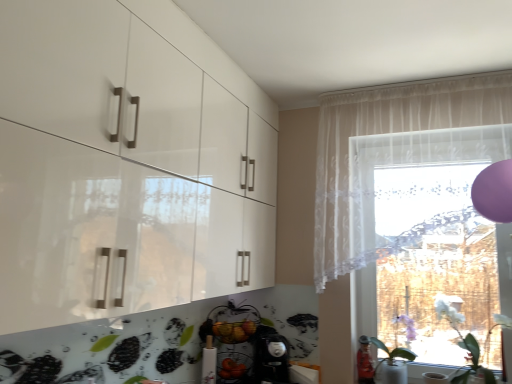
Measure the distance between transparent lace curtain at right and camera.

transparent lace curtain at right is 2.14 meters from camera.

What is the approximate height of white matte plant at lower right, which ranks as the 1th plant in right-to-left order?

19.20 inches.

This screenshot has width=512, height=384. I want to click on transparent lace curtain at right, so click(426, 231).

Does white glossy vase at lower right, which ranks as the 2th plant in right-to-left order, lie behind sheer white curtain at upper right?

Yes, it is.

Is white glossy vase at lower right, which ranks as the 2th plant in right-to-left order, positioned with its back to sheer white curtain at upper right?

white glossy vase at lower right, which ranks as the 2th plant in right-to-left order, is not turned away from sheer white curtain at upper right.

Does white glossy vase at lower right, which ranks as the 2th plant in right-to-left order, touch sheer white curtain at upper right?

No, white glossy vase at lower right, which ranks as the 2th plant in right-to-left order, is not beside sheer white curtain at upper right.

Do you think white glossy vase at lower right, arranged as the 1th plant when viewed from the left, is within sheer white curtain at upper right, or outside of it?

white glossy vase at lower right, arranged as the 1th plant when viewed from the left, exists outside the volume of sheer white curtain at upper right.

Which is nearer, (459,315) or (373,199)?

The point (459,315) is closer to the camera.

From the image's perspective, which one is positioned higher, white matte plant at lower right, which ranks as the 1th plant in right-to-left order, or transparent lace curtain at right?

transparent lace curtain at right.

How many degrees apart are the facing directions of white matte plant at lower right, which ranks as the 1th plant in right-to-left order, and transparent lace curtain at right?

There is a 0.000495-degree angle between the facing directions of white matte plant at lower right, which ranks as the 1th plant in right-to-left order, and transparent lace curtain at right.

Is white matte plant at lower right, which ranks as the second plant in left-to-right order, surrounding transparent lace curtain at right?

Actually, transparent lace curtain at right is outside white matte plant at lower right, which ranks as the second plant in left-to-right order.

From a real-world perspective, which is physically below, transparent lace curtain at right or white glossy vase at lower right, arranged as the 1th plant when viewed from the left?

white glossy vase at lower right, arranged as the 1th plant when viewed from the left, is physically lower.

Considering the positions of objects transparent lace curtain at right and white glossy vase at lower right, arranged as the 1th plant when viewed from the left, in the image provided, who is in front, transparent lace curtain at right or white glossy vase at lower right, arranged as the 1th plant when viewed from the left,?

Positioned in front is transparent lace curtain at right.

Looking at this image, which is more to the left, transparent lace curtain at right or white glossy vase at lower right, which ranks as the 2th plant in right-to-left order?

white glossy vase at lower right, which ranks as the 2th plant in right-to-left order, is more to the left.

Which is closer to the camera, (450,292) or (405,317)?

Point (450,292).

Consider the image. Is transparent lace curtain at right shorter than sheer white curtain at upper right?

In fact, transparent lace curtain at right may be taller than sheer white curtain at upper right.

Based on the photo, between transparent lace curtain at right and sheer white curtain at upper right, which one is positioned behind?

transparent lace curtain at right is more distant.

Is sheer white curtain at upper right surrounded by transparent lace curtain at right?

No, sheer white curtain at upper right is not a part of transparent lace curtain at right.

How different are the orientations of white glossy vase at lower right, arranged as the 1th plant when viewed from the left, and transparent lace curtain at right in degrees?

The angle between the facing direction of white glossy vase at lower right, arranged as the 1th plant when viewed from the left, and the facing direction of transparent lace curtain at right is 0.000183 degrees.

Is white glossy vase at lower right, which ranks as the 2th plant in right-to-left order, looking in the opposite direction of transparent lace curtain at right?

Yes, white glossy vase at lower right, which ranks as the 2th plant in right-to-left order, is facing away from transparent lace curtain at right.

In the scene shown: Which object is more forward, white glossy vase at lower right, arranged as the 1th plant when viewed from the left, or transparent lace curtain at right?

transparent lace curtain at right is closer to the camera.

Can you confirm if white glossy vase at lower right, arranged as the 1th plant when viewed from the left, is positioned to the left of transparent lace curtain at right?

Yes.

The height and width of the screenshot is (384, 512). Find the location of `plant in front of the transparent lace curtain at right`. plant in front of the transparent lace curtain at right is located at coordinates (464, 344).

Between transparent lace curtain at right and white matte plant at lower right, which ranks as the 1th plant in right-to-left order, which one appears on the left side from the viewer's perspective?

Positioned to the left is transparent lace curtain at right.

From a real-world perspective, is transparent lace curtain at right physically below white matte plant at lower right, which ranks as the second plant in left-to-right order?

No, from a real-world perspective, transparent lace curtain at right is not beneath white matte plant at lower right, which ranks as the second plant in left-to-right order.

Between point (486, 242) and point (474, 371), which one is positioned in front?

The point (486, 242) is in front.

Between sheer white curtain at upper right and transparent lace curtain at right, which one has more height?

transparent lace curtain at right is taller.

At what (x,y) coordinates should I click in order to perform the action: click on curtain in front of the transparent lace curtain at right. Please return your answer as a coordinate pair (x, y). This screenshot has width=512, height=384. Looking at the image, I should click on (389, 132).

Considering the relative sizes of sheer white curtain at upper right and transparent lace curtain at right in the image provided, is sheer white curtain at upper right thinner than transparent lace curtain at right?

Correct, the width of sheer white curtain at upper right is less than that of transparent lace curtain at right.

Could you tell me if sheer white curtain at upper right is facing transparent lace curtain at right?

Yes, sheer white curtain at upper right is turned towards transparent lace curtain at right.

There is a sheer white curtain at upper right. Where is `the 2nd plant below it (from a real-world perspective)`? The height and width of the screenshot is (384, 512). the 2nd plant below it (from a real-world perspective) is located at coordinates (392, 363).

In order to click on plant in front of the transparent lace curtain at right in this screenshot , I will do `click(464, 344)`.

Which object lies nearer to the anchor point sheer white curtain at upper right, white glossy vase at lower right, arranged as the 1th plant when viewed from the left, or white matte plant at lower right, which ranks as the second plant in left-to-right order?

white glossy vase at lower right, arranged as the 1th plant when viewed from the left.

From the image, which object appears to be farther from white matte plant at lower right, which ranks as the second plant in left-to-right order, sheer white curtain at upper right or white glossy vase at lower right, arranged as the 1th plant when viewed from the left?

sheer white curtain at upper right is positioned further to the anchor white matte plant at lower right, which ranks as the second plant in left-to-right order.

Which object lies further to the anchor point white glossy vase at lower right, which ranks as the 2th plant in right-to-left order, sheer white curtain at upper right or white matte plant at lower right, which ranks as the second plant in left-to-right order?

Based on the image, sheer white curtain at upper right appears to be further to white glossy vase at lower right, which ranks as the 2th plant in right-to-left order.

From the image, which object appears to be farther from sheer white curtain at upper right, white matte plant at lower right, which ranks as the second plant in left-to-right order, or white glossy vase at lower right, which ranks as the 2th plant in right-to-left order?

The object further to sheer white curtain at upper right is white matte plant at lower right, which ranks as the second plant in left-to-right order.

When comparing their distances from transparent lace curtain at right, does sheer white curtain at upper right or white glossy vase at lower right, which ranks as the 2th plant in right-to-left order, seem further?

white glossy vase at lower right, which ranks as the 2th plant in right-to-left order.

Looking at the image, which one is located closer to sheer white curtain at upper right, white matte plant at lower right, which ranks as the second plant in left-to-right order, or transparent lace curtain at right?

Based on the image, transparent lace curtain at right appears to be nearer to sheer white curtain at upper right.

From the image, which object appears to be farther from transparent lace curtain at right, white matte plant at lower right, which ranks as the 1th plant in right-to-left order, or sheer white curtain at upper right?

white matte plant at lower right, which ranks as the 1th plant in right-to-left order, is positioned further to the anchor transparent lace curtain at right.

When comparing their distances from white glossy vase at lower right, arranged as the 1th plant when viewed from the left, does white matte plant at lower right, which ranks as the second plant in left-to-right order, or sheer white curtain at upper right seem closer?

white matte plant at lower right, which ranks as the second plant in left-to-right order.

Identify the location of plant that lies between transparent lace curtain at right and white glossy vase at lower right, arranged as the 1th plant when viewed from the left, from top to bottom. The height and width of the screenshot is (384, 512). (464, 344).

Where is `plant between sheer white curtain at upper right and white glossy vase at lower right, which ranks as the 2th plant in right-to-left order, in the up-down direction`? The width and height of the screenshot is (512, 384). plant between sheer white curtain at upper right and white glossy vase at lower right, which ranks as the 2th plant in right-to-left order, in the up-down direction is located at coordinates (464, 344).

This screenshot has width=512, height=384. In order to click on window between sheer white curtain at upper right and white matte plant at lower right, which ranks as the 1th plant in right-to-left order, vertically in this screenshot , I will do coord(426,231).

Identify the location of window between sheer white curtain at upper right and white glossy vase at lower right, arranged as the 1th plant when viewed from the left, vertically. The height and width of the screenshot is (384, 512). (426, 231).